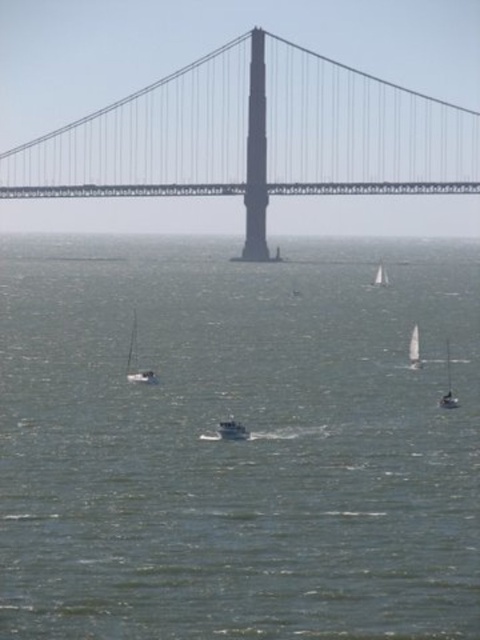
You are standing on the suspension bridge and see a point marked at coordinates (238, 442) in the image. Based on the scene description, can you determine what surface this point is located on?

The point at coordinates (238, 442) is on greenish blue water at center, so it is located on the water surface.